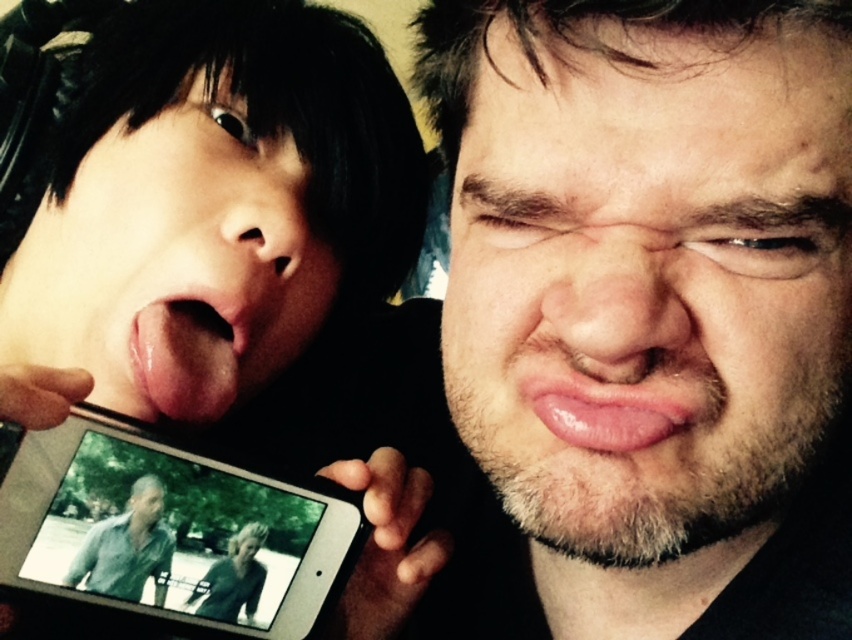
Question: Which point is closer to the camera?

Choices:
 (A) (68, 337)
 (B) (567, 406)

Answer: (B)

Question: Among these points, which one is farthest from the camera?

Choices:
 (A) (213, 490)
 (B) (160, 401)
 (C) (515, 113)
 (D) (246, 275)

Answer: (D)

Question: Is pink flesh at center wider than glossy pink lips at center?

Choices:
 (A) no
 (B) yes

Answer: (B)

Question: In this image, where is beige facial hair at center located relative to silver metallic phone at center?

Choices:
 (A) right
 (B) left

Answer: (A)

Question: Can you confirm if pink flesh at center is smaller than glossy pink lips at center?

Choices:
 (A) no
 (B) yes

Answer: (A)

Question: Which object appears closest to the camera in this image?

Choices:
 (A) glossy pink lips at center
 (B) pink smooth tongue at center
 (C) pink flesh at center
 (D) silver metallic phone at center

Answer: (A)